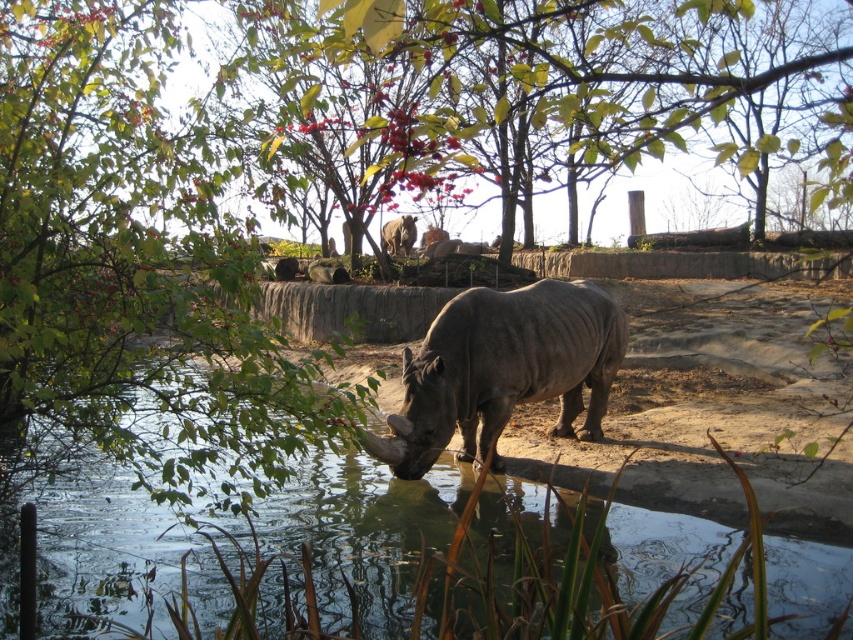
Between point (646, 540) and point (390, 243), which one is positioned in front?

Point (646, 540) is in front.

Can you confirm if transparent water at center is thinner than gray matte rhinoceros at upper center?

Indeed, transparent water at center has a lesser width compared to gray matte rhinoceros at upper center.

You are a GUI agent. You are given a task and a screenshot of the screen. Output one action in this format:
    pyautogui.click(x=<x>, y=<y>)
    Task: Click on the transparent water at center
    This screenshot has height=640, width=853.
    Given the screenshot: What is the action you would take?
    pyautogui.click(x=424, y=563)

Locate an element on the screen. The image size is (853, 640). transparent water at center is located at coordinates (424, 563).

Who is more distant from viewer, (624, 332) or (407, 218)?

Point (407, 218)

Is gray matte rhinoceros at center to the right of gray matte rhinoceros at upper center from the viewer's perspective?

Correct, you'll find gray matte rhinoceros at center to the right of gray matte rhinoceros at upper center.

Does point (447, 324) lie in front of point (399, 221)?

Yes, point (447, 324) is closer to viewer.

I want to click on gray matte rhinoceros at center, so click(x=502, y=371).

Is transparent water at center above gray matte rhinoceros at center?

Indeed, transparent water at center is positioned over gray matte rhinoceros at center.

Does point (224, 614) lie in front of point (577, 401)?

Yes.

Where is `transparent water at center`? The image size is (853, 640). transparent water at center is located at coordinates (424, 563).